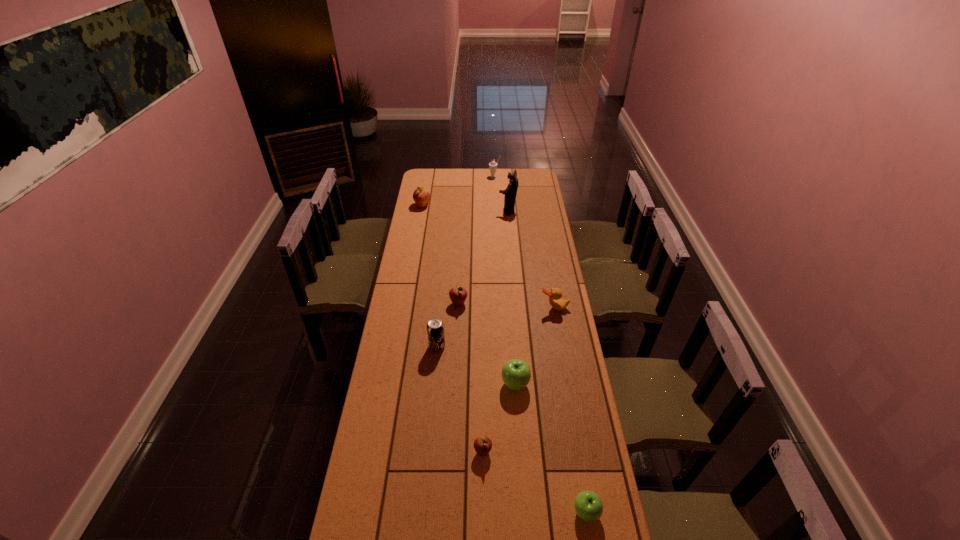
Identify the location of figurine. (510, 192).

The height and width of the screenshot is (540, 960). Identify the location of milkshake. (492, 165).

Find the location of a particular element. This screenshot has height=540, width=960. the farthest object is located at coordinates (492, 165).

What are the coordinates of `the tallest apple` in the screenshot? It's located at (421, 196).

Identify the location of the leftmost apple. This screenshot has width=960, height=540. (421, 196).

This screenshot has height=540, width=960. Find the location of `the second object from left to right`. the second object from left to right is located at coordinates (435, 328).

The height and width of the screenshot is (540, 960). Identify the location of the fourth nearest object. (435, 328).

Locate an element on the screen. The height and width of the screenshot is (540, 960). the second farthest apple is located at coordinates point(458,295).

The height and width of the screenshot is (540, 960). I want to click on the second biggest red apple, so click(x=458, y=295).

Find the location of a particular element. The width and height of the screenshot is (960, 540). the bigger green apple is located at coordinates (516, 374).